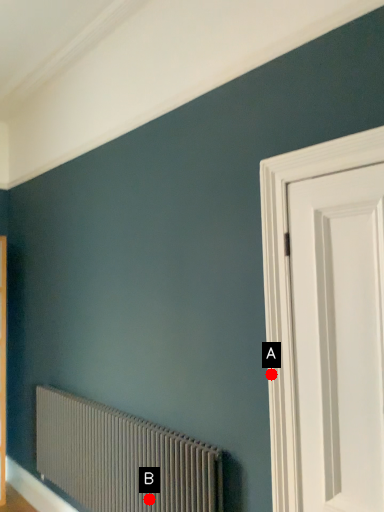
Question: Two points are circled on the image, labeled by A and B beside each circle. Among these points, which one is nearest to the camera?

Choices:
 (A) A is closer
 (B) B is closer

Answer: (A)